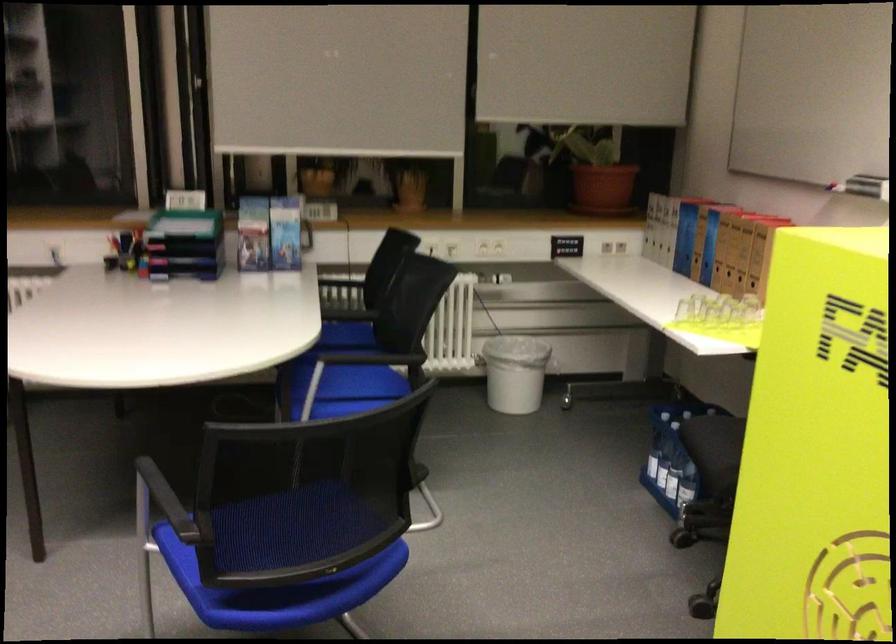
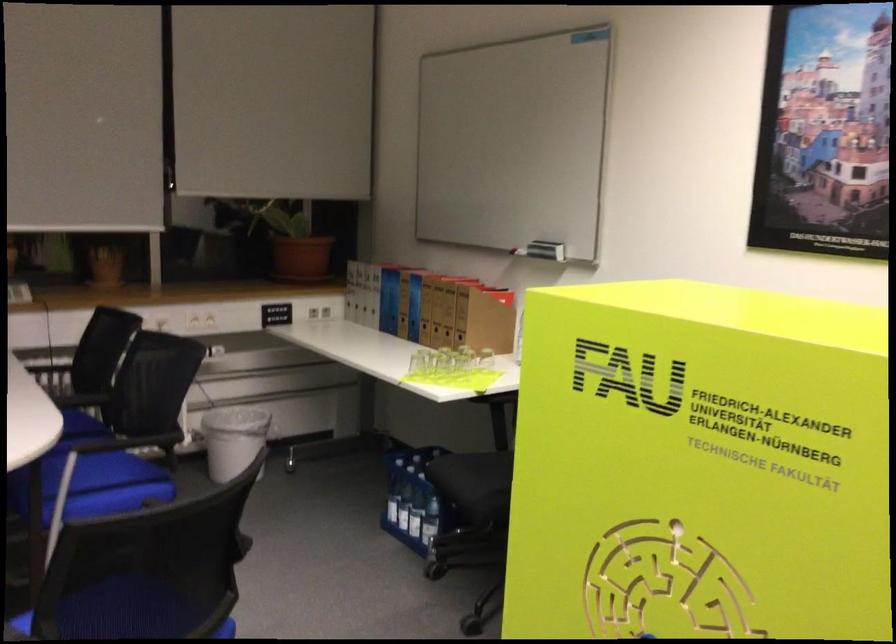
In the second image, find the point that corresponds to [686,480] in the first image.

(429, 520)